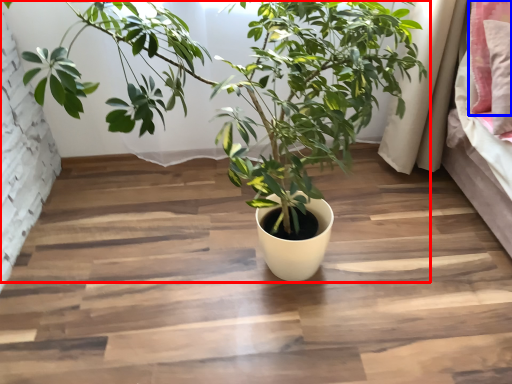
Question: Which object is further to the camera taking this photo, houseplant (highlighted by a red box) or pillow (highlighted by a blue box)?

Choices:
 (A) houseplant
 (B) pillow

Answer: (B)